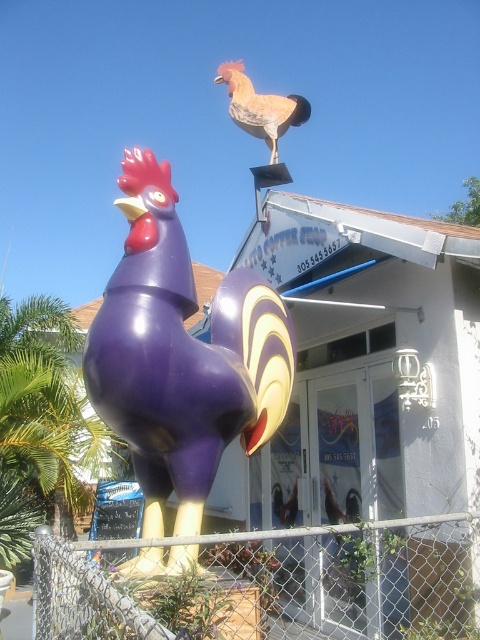
You are a customer entering the coffee shop and see the chain link fence at lower center and the matte orange rooster at upper center. Which object is closer to the entrance of the coffee shop?

The chain link fence at lower center is closer to the entrance of the coffee shop because it is positioned to the right of the matte orange rooster at upper center, which is further away.

You are a visitor trying to take a photo of the purple glossy rooster at lower left and the matte orange rooster at upper center. Which rooster should you focus on first if you want to capture both in one frame without moving your camera? Explain your reasoning.

The purple glossy rooster at lower left is much taller than the matte orange rooster at upper center. Therefore, to capture both in one frame without moving the camera, you should focus on the purple glossy rooster at lower left first since it is larger and might require more adjustment to fit within the frame.